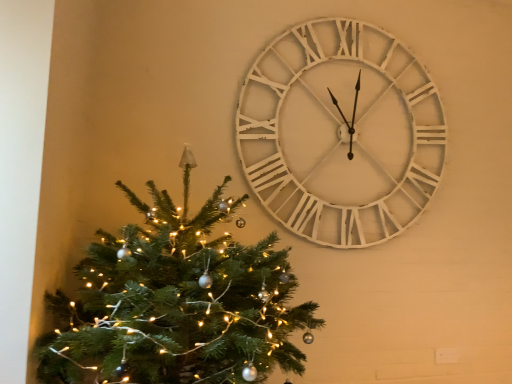
Question: Is white wooden clock at upper right not within green matte christmas tree at left?

Choices:
 (A) yes
 (B) no

Answer: (A)

Question: Is white wooden clock at upper right aimed at green matte christmas tree at left?

Choices:
 (A) no
 (B) yes

Answer: (A)

Question: Is white wooden clock at upper right further to the viewer compared to green matte christmas tree at left?

Choices:
 (A) no
 (B) yes

Answer: (B)

Question: From the image's perspective, is white wooden clock at upper right under green matte christmas tree at left?

Choices:
 (A) yes
 (B) no

Answer: (B)

Question: Is white wooden clock at upper right beside green matte christmas tree at left?

Choices:
 (A) yes
 (B) no

Answer: (B)

Question: Is white wooden clock at upper right oriented away from green matte christmas tree at left?

Choices:
 (A) yes
 (B) no

Answer: (B)

Question: Considering the relative sizes of green matte christmas tree at left and white wooden clock at upper right in the image provided, is green matte christmas tree at left bigger than white wooden clock at upper right?

Choices:
 (A) yes
 (B) no

Answer: (A)

Question: Is green matte christmas tree at left looking in the opposite direction of white wooden clock at upper right?

Choices:
 (A) yes
 (B) no

Answer: (B)

Question: Can you confirm if green matte christmas tree at left is smaller than white wooden clock at upper right?

Choices:
 (A) yes
 (B) no

Answer: (B)

Question: From a real-world perspective, is green matte christmas tree at left under white wooden clock at upper right?

Choices:
 (A) yes
 (B) no

Answer: (A)

Question: Does green matte christmas tree at left have a greater height compared to white wooden clock at upper right?

Choices:
 (A) no
 (B) yes

Answer: (A)

Question: From a real-world perspective, is green matte christmas tree at left located higher than white wooden clock at upper right?

Choices:
 (A) yes
 (B) no

Answer: (B)

Question: From the image's perspective, is white wooden clock at upper right above or below green matte christmas tree at left?

Choices:
 (A) below
 (B) above

Answer: (B)